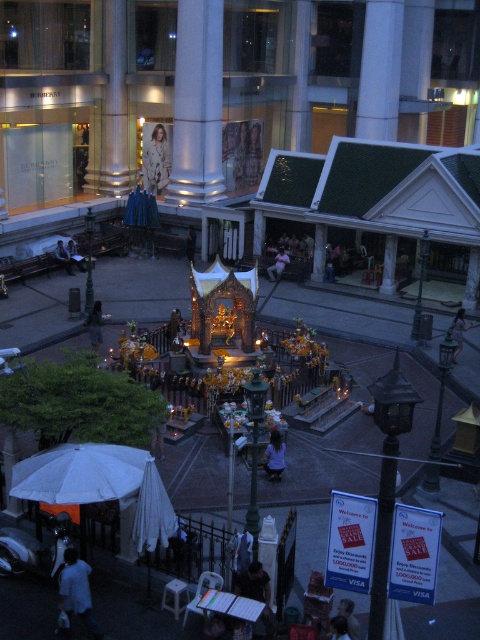
You are standing at the elevated viewpoint looking down at the urban scene. There are two points marked in the image. The first point is at coordinate point (93, 636) and the second point is at coordinate point (194, 246). Which point is closer to your current position?

Point (93, 636) is closer to the camera than point (194, 246), so the first point is closer to your current position.

You are a photographer standing at the elevated viewpoint of the urban scene. You notice a person wearing a dark blue shirt at center and another with a smooth skin face at center. Which of these two has a more prominent appearance in the photo?

The dark blue shirt at center has a larger size compared to the smooth skin face at center, so the dark blue shirt at center is more prominent in the photo.

You are a photographer planning to take a photo of the light brown fabric at center and light beige fabric at center in the scene. Which fabric should you focus on first if you want to capture both in a single shot without moving the camera, considering their heights?

The light brown fabric at center is shorter than the light beige fabric at center. To capture both in a single shot without moving the camera, focus on the light beige fabric at center first since it is taller and will require adjusting the framing to include the shorter light brown fabric at center.